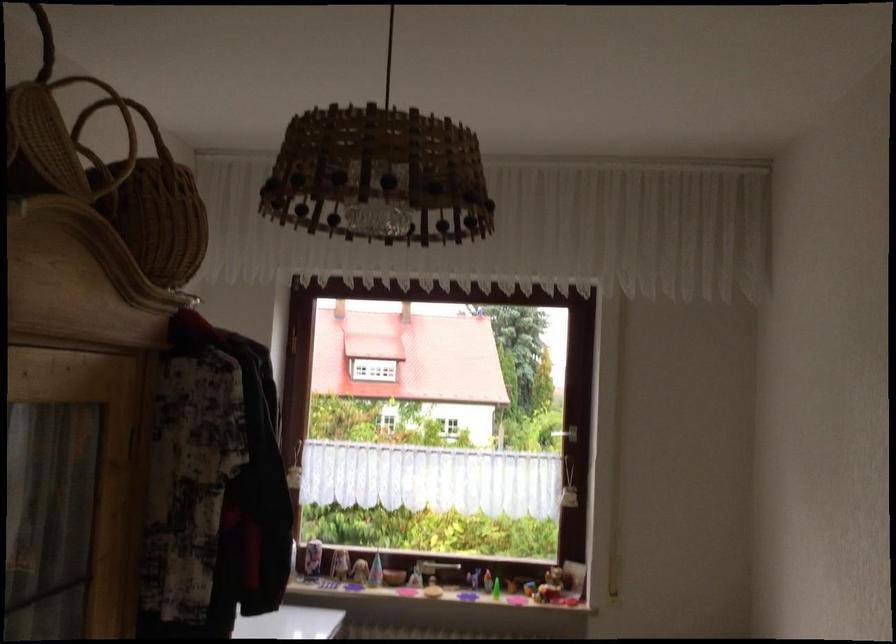
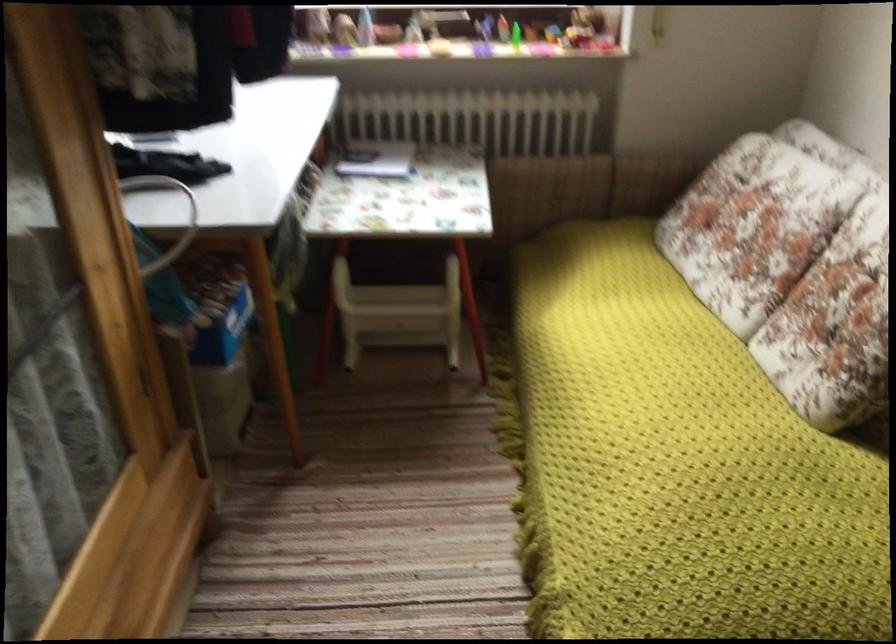
Question: The images are taken continuously from a first-person perspective. In which direction is your viewpoint rotating?

Choices:
 (A) Left
 (B) Right
 (C) Up
 (D) Down

Answer: (D)